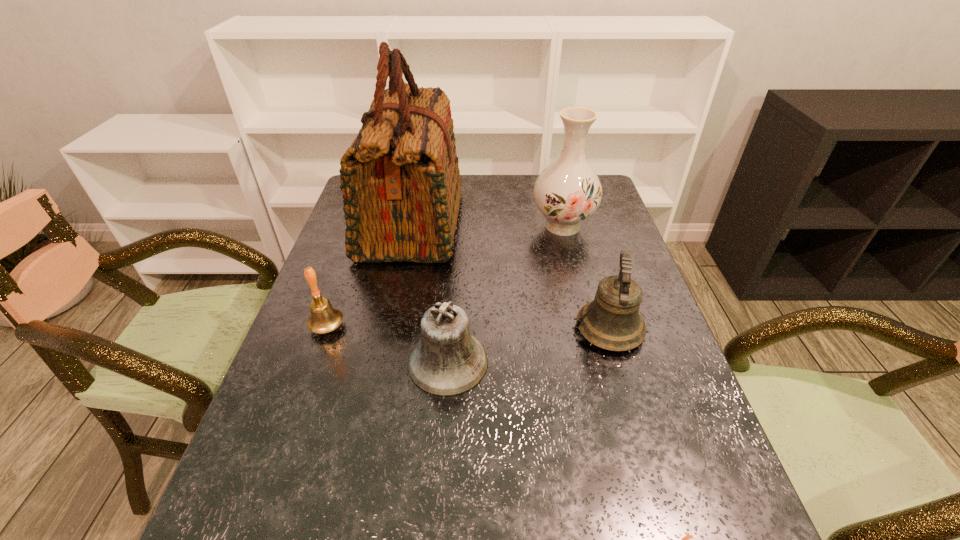
The image size is (960, 540). Identify the location of the tallest object. (400, 179).

This screenshot has width=960, height=540. I want to click on the second tallest object, so click(567, 192).

Identify the location of the rightmost bell. (611, 321).

Identify the location of the leftmost bell. The width and height of the screenshot is (960, 540). (324, 318).

I want to click on the second bell from right to left, so click(x=447, y=361).

Identify the location of vacant point located on the open handle side of the tallest object. The height and width of the screenshot is (540, 960). (517, 224).

Locate an element on the screen. This screenshot has height=540, width=960. free location located 0.050m on the right of the vase is located at coordinates (611, 226).

Locate an element on the screen. This screenshot has height=540, width=960. free point located 0.050m on the left of the rightmost bell is located at coordinates (553, 330).

This screenshot has width=960, height=540. I want to click on vacant space located on the back of the leftmost bell, so click(x=351, y=259).

At what (x,y) coordinates should I click in order to perform the action: click on free location located on the left of the second bell from left to right. Please return your answer as a coordinate pair (x, y). The height and width of the screenshot is (540, 960). Looking at the image, I should click on (300, 362).